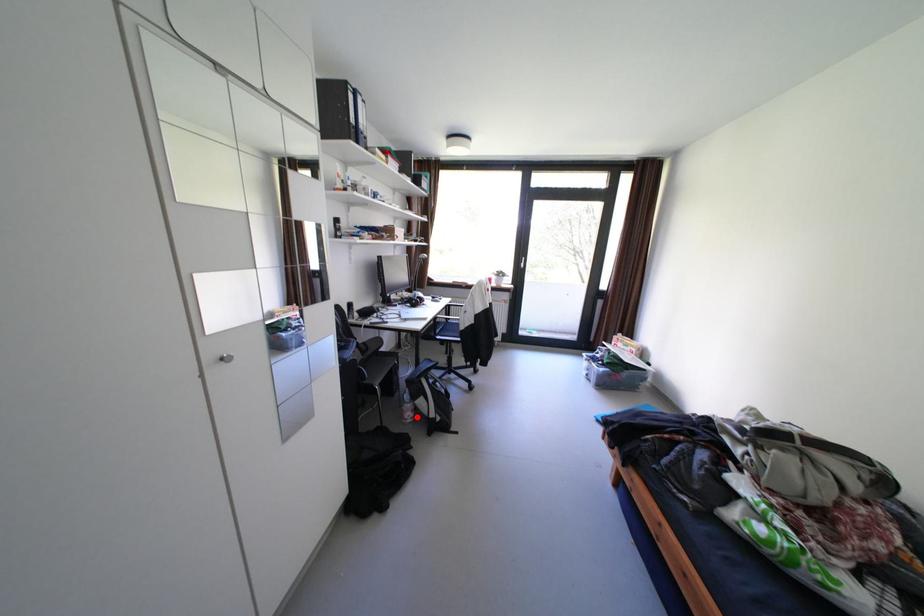
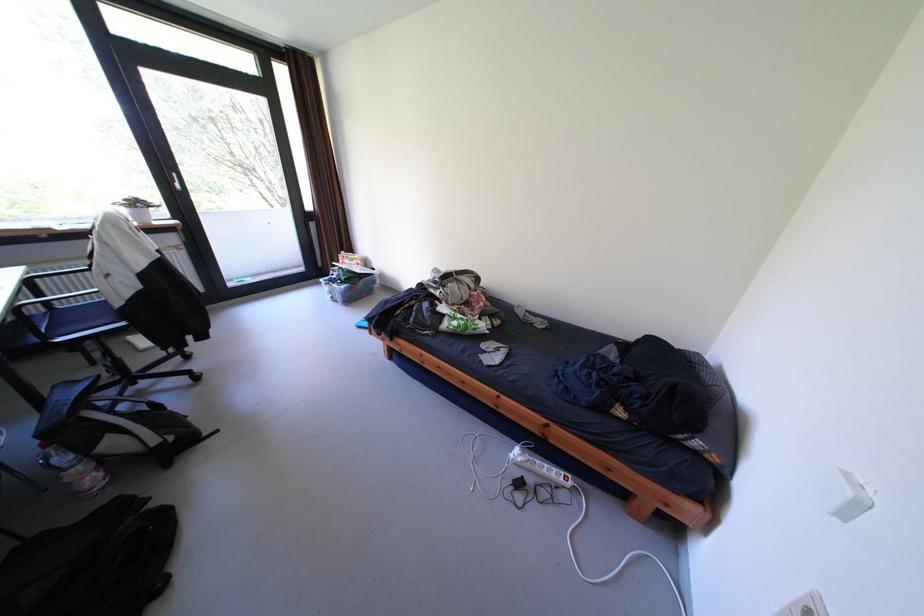
In the second image, find the point that corresponds to the highlighted location in the first image.

(99, 485)